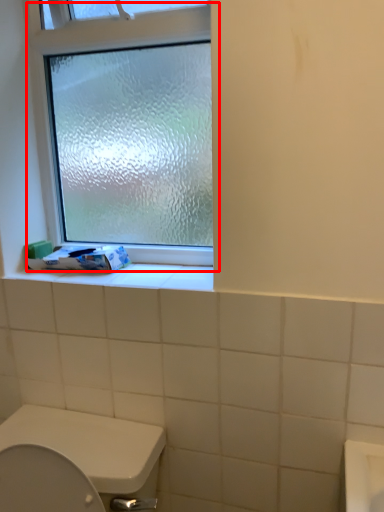
Question: From the image's perspective, what is the correct spatial relationship of window (annotated by the red box) in relation to toilet paper?

Choices:
 (A) above
 (B) below

Answer: (A)